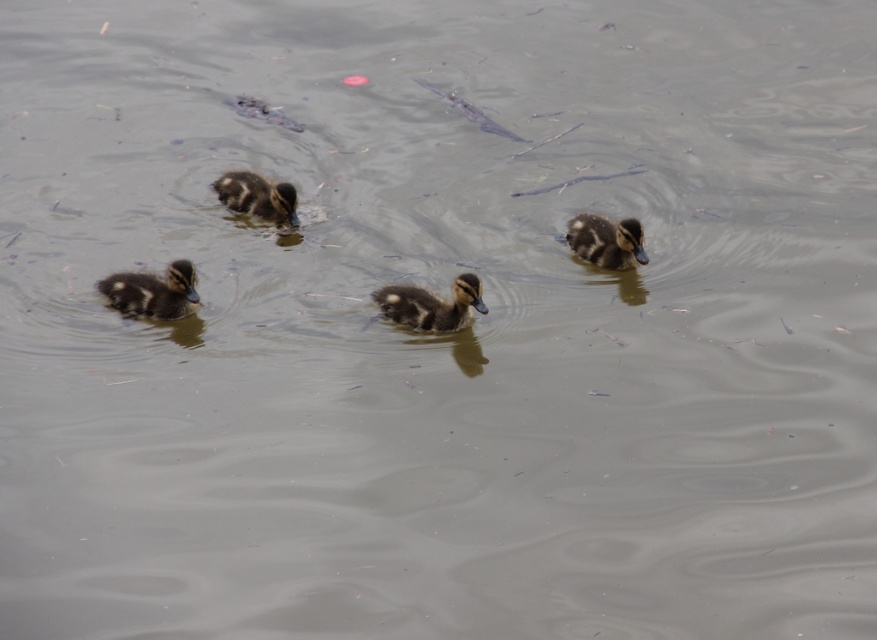
Does brown fuzzy duckling at lower left have a lesser width compared to brown fuzzy duckling at center?

Yes.

In the scene shown: Does brown fuzzy duckling at lower left appear on the left side of brown fuzzy duckling at center?

Correct, you'll find brown fuzzy duckling at lower left to the left of brown fuzzy duckling at center.

Which is behind, point (102, 285) or point (405, 308)?

Point (102, 285)

Identify the location of brown fuzzy duckling at lower left. (153, 291).

Is brown fuzzy duckling at lower left to the left of brown fuzzy duckling at right from the viewer's perspective?

Yes, brown fuzzy duckling at lower left is to the left of brown fuzzy duckling at right.

At what (x,y) coordinates should I click in order to perform the action: click on brown fuzzy duckling at lower left. Please return your answer as a coordinate pair (x, y). Image resolution: width=877 pixels, height=640 pixels. Looking at the image, I should click on (153, 291).

Does point (438, 317) come in front of point (612, 268)?

Yes, it is in front of point (612, 268).

Is point (466, 298) positioned behind point (578, 244)?

No, it is not.

At what (x,y) coordinates should I click in order to perform the action: click on brown fuzzy duckling at center. Please return your answer as a coordinate pair (x, y). Looking at the image, I should click on (431, 305).